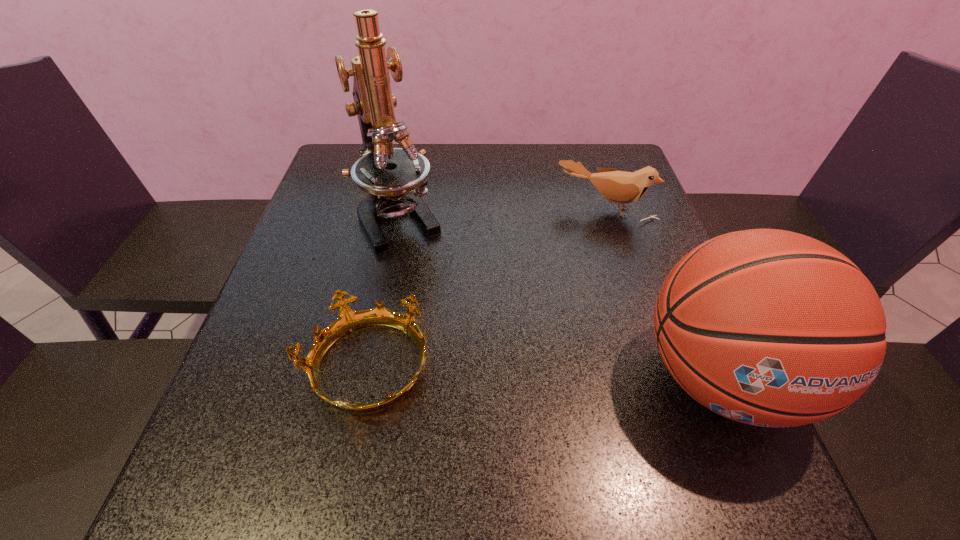
Where is `free space located at the eyepiece of the tallest object`? free space located at the eyepiece of the tallest object is located at coordinates (468, 336).

The image size is (960, 540). Find the location of `object located at the far edge`. object located at the far edge is located at coordinates (396, 178).

I want to click on crown positioned at the near edge, so click(349, 320).

This screenshot has height=540, width=960. I want to click on basketball positioned at the near edge, so click(767, 327).

You are a GUI agent. You are given a task and a screenshot of the screen. Output one action in this format:
    pyautogui.click(x=<x>, y=<y>)
    Task: Click on the crown that is at the left edge
    
    Given the screenshot: What is the action you would take?
    pyautogui.click(x=349, y=320)

The width and height of the screenshot is (960, 540). What are the coordinates of `microscope located at the left edge` in the screenshot? It's located at (396, 178).

This screenshot has height=540, width=960. Identify the location of basketball located in the right edge section of the desktop. click(x=767, y=327).

Locate an element on the screen. This screenshot has height=540, width=960. bird at the right edge is located at coordinates (618, 187).

Locate an element on the screen. object at the far left corner is located at coordinates (396, 178).

Locate an element on the screen. object located at the near left corner is located at coordinates (349, 320).